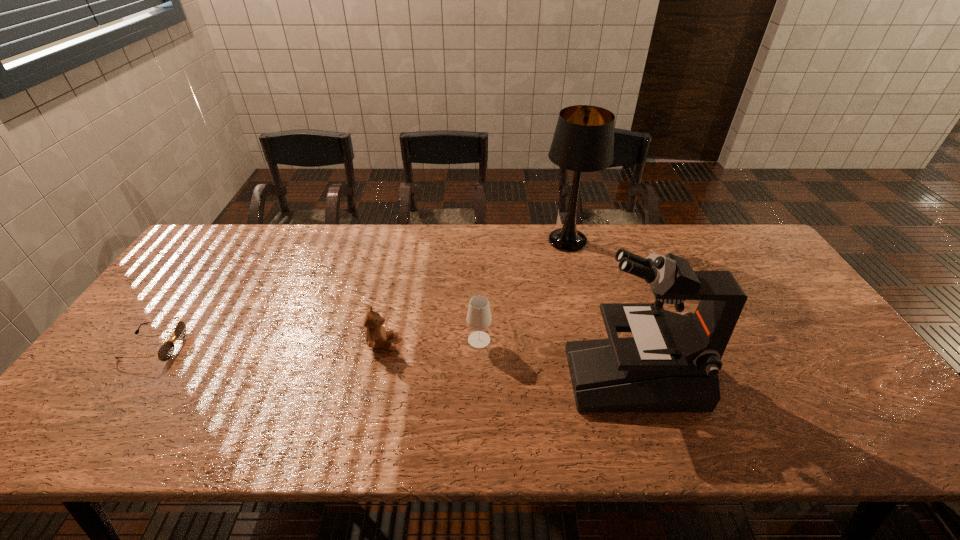
In the image, there is a desktop. In order to click on vacant space at the right edge in this screenshot , I will do `click(768, 291)`.

I want to click on vacant space at the far left corner, so click(x=204, y=239).

The height and width of the screenshot is (540, 960). I want to click on free spot at the far right corner of the desktop, so click(x=722, y=246).

Locate an element on the screen. This screenshot has height=540, width=960. free space between the glass and the microscope is located at coordinates (557, 359).

At what (x,y) coordinates should I click in order to perform the action: click on vacant point located between the shortest object and the microscope. Please return your answer as a coordinate pair (x, y). Looking at the image, I should click on (394, 362).

This screenshot has width=960, height=540. I want to click on vacant region between the shortest object and the glass, so click(316, 343).

Locate an element on the screen. vacant area that lies between the glass and the second shortest object is located at coordinates (431, 341).

At what (x,y) coordinates should I click in order to perform the action: click on free spot between the microscope and the shortest object. Please return your answer as a coordinate pair (x, y). Image resolution: width=960 pixels, height=540 pixels. Looking at the image, I should click on (394, 362).

I want to click on free area in between the teddy bear and the microscope, so click(509, 360).

At what (x,y) coordinates should I click in order to perform the action: click on empty location between the microscope and the glass. Please return your answer as a coordinate pair (x, y). Looking at the image, I should click on point(557,359).